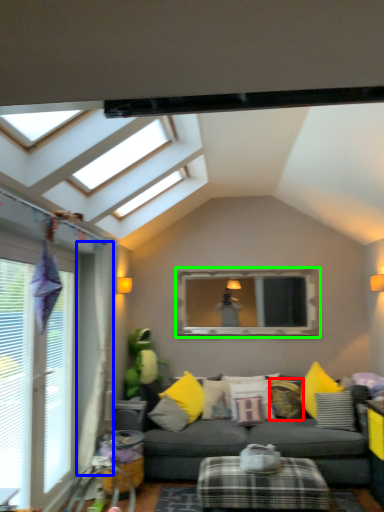
Question: Based on their relative distances, which object is nearer to pillow (highlighted by a red box)? Choose from curtain (highlighted by a blue box) and bay window (highlighted by a green box).

Choices:
 (A) curtain
 (B) bay window

Answer: (B)